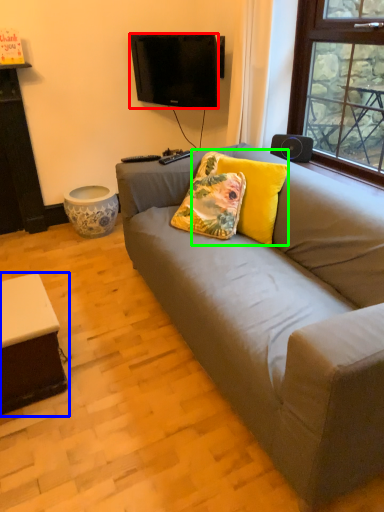
Question: Which object is the farthest from television (highlighted by a red box)? Choose among these: table (highlighted by a blue box) or pillow (highlighted by a green box).

Choices:
 (A) table
 (B) pillow

Answer: (A)